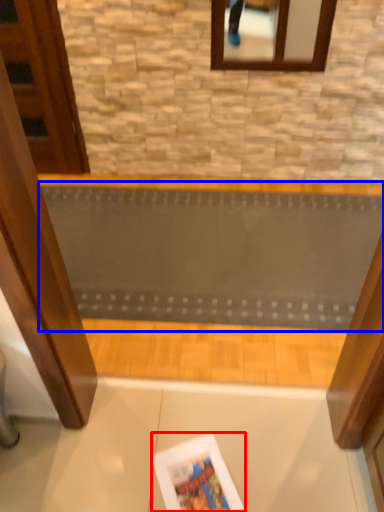
Question: Which point is further to the camera, magazine (highlighted by a red box) or ramp (highlighted by a blue box)?

Choices:
 (A) magazine
 (B) ramp

Answer: (B)